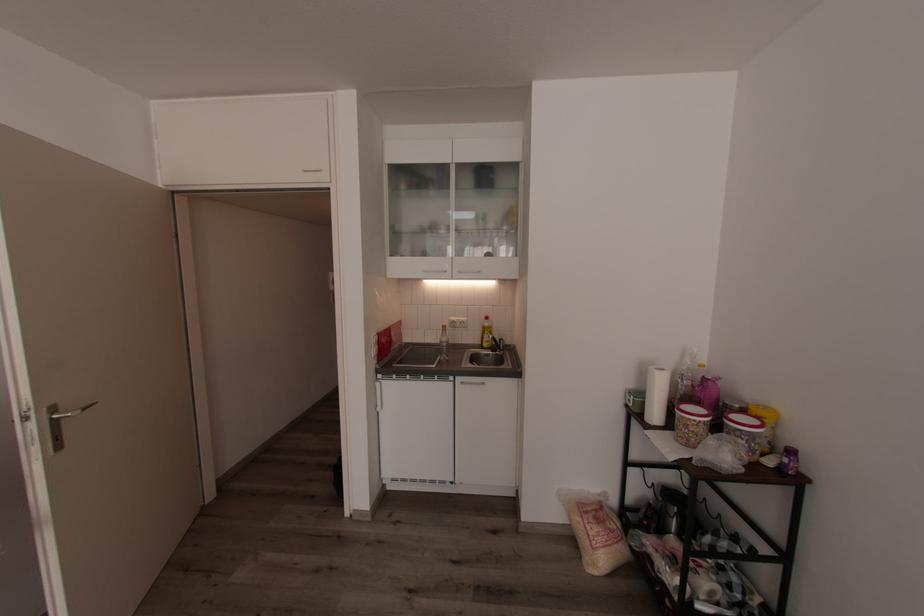
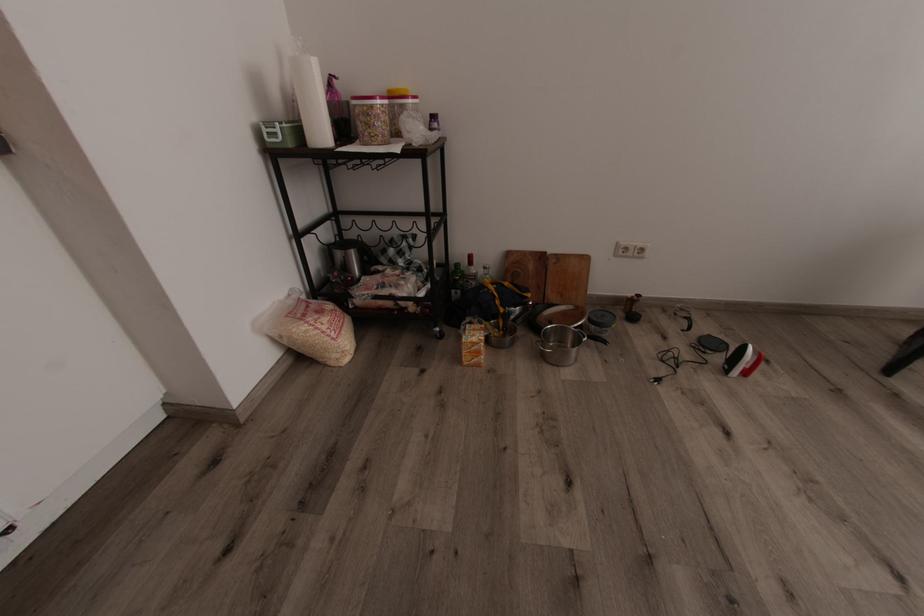
Find the pixel in the second image that matches [690,426] in the first image.

(382, 116)